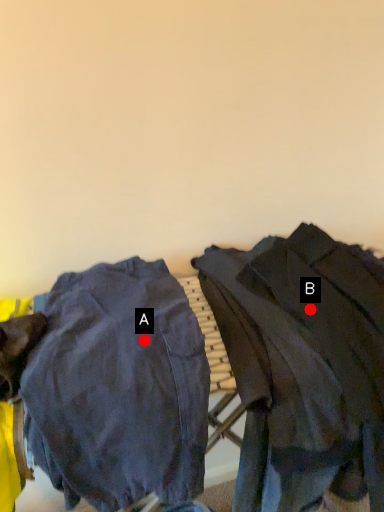
Question: Two points are circled on the image, labeled by A and B beside each circle. Which point is closer to the camera?

Choices:
 (A) A is closer
 (B) B is closer

Answer: (A)